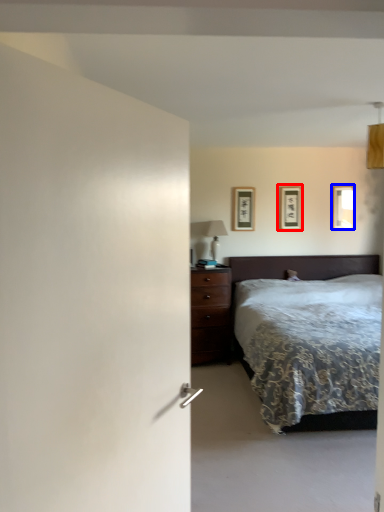
Question: Which object appears farthest to the camera in this image, picture frame (highlighted by a red box) or picture frame (highlighted by a blue box)?

Choices:
 (A) picture frame
 (B) picture frame

Answer: (B)